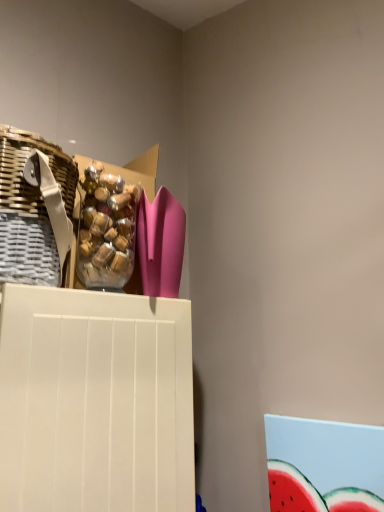
Question: Choose the correct answer: Is translucent plastic bag of candies at upper left inside woven brown basket at left or outside it?

Choices:
 (A) outside
 (B) inside

Answer: (A)

Question: In the image, is translucent plastic bag of candies at upper left positioned in front of or behind woven brown basket at left?

Choices:
 (A) behind
 (B) front

Answer: (A)

Question: In terms of height, does translucent plastic bag of candies at upper left look taller or shorter compared to woven brown basket at left?

Choices:
 (A) short
 (B) tall

Answer: (A)

Question: From a real-world perspective, relative to translucent plastic bag of candies at upper left, is woven brown basket at left vertically above or below?

Choices:
 (A) above
 (B) below

Answer: (A)

Question: Is woven brown basket at left in front of or behind translucent plastic bag of candies at upper left in the image?

Choices:
 (A) behind
 (B) front

Answer: (B)

Question: Would you say woven brown basket at left is inside or outside translucent plastic bag of candies at upper left?

Choices:
 (A) outside
 (B) inside

Answer: (A)

Question: Is woven brown basket at left taller or shorter than translucent plastic bag of candies at upper left?

Choices:
 (A) tall
 (B) short

Answer: (A)